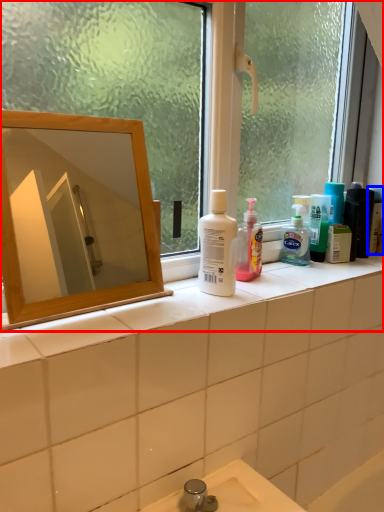
Question: Which object is closer to the camera taking this photo, window (highlighted by a red box) or toiletry (highlighted by a blue box)?

Choices:
 (A) window
 (B) toiletry

Answer: (A)